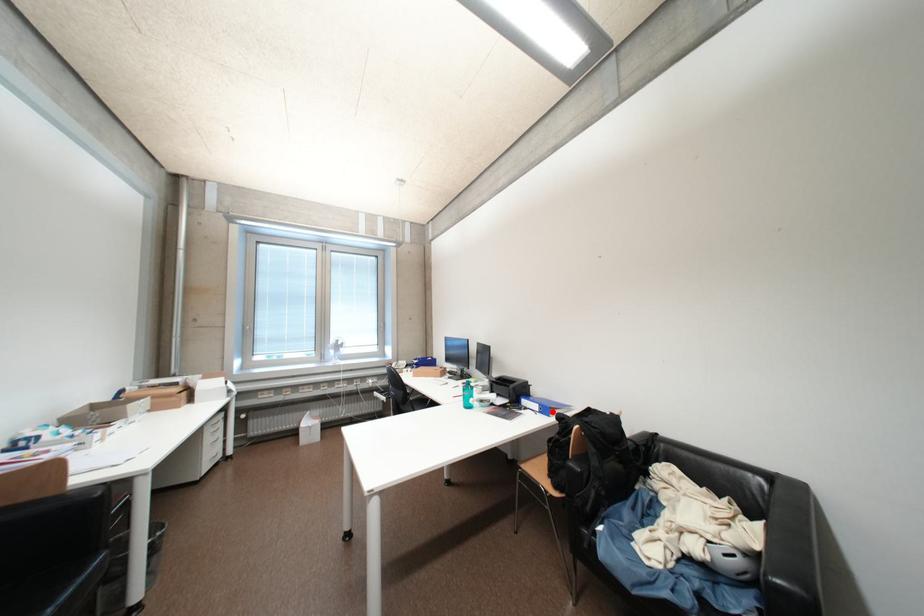
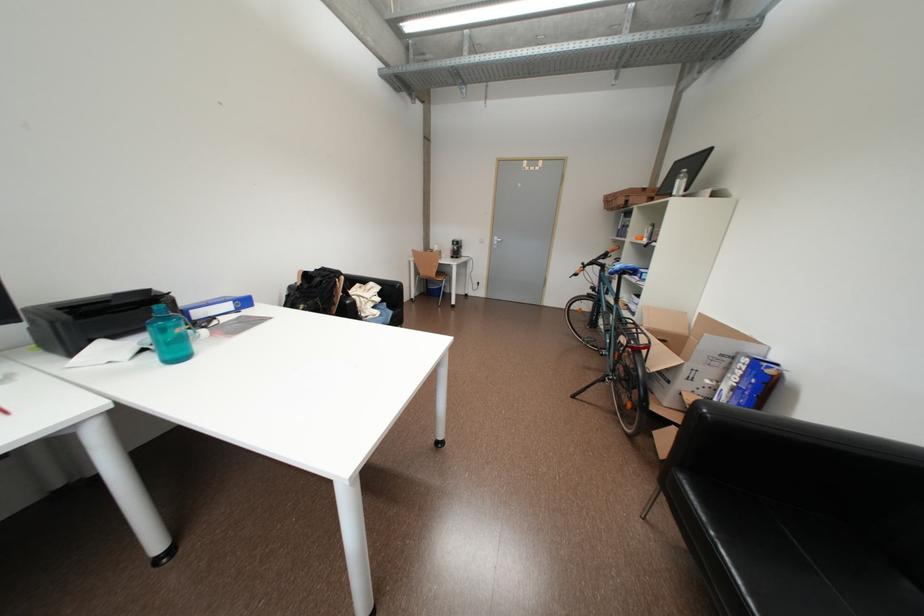
Question: A red point is marked in image1. In image2, is the corresponding 3D point closer to the camera or farther? Reply with the corresponding letter.

Choices:
 (A) The corresponding 3D point is closer.
 (B) The corresponding 3D point is farther.

Answer: (A)